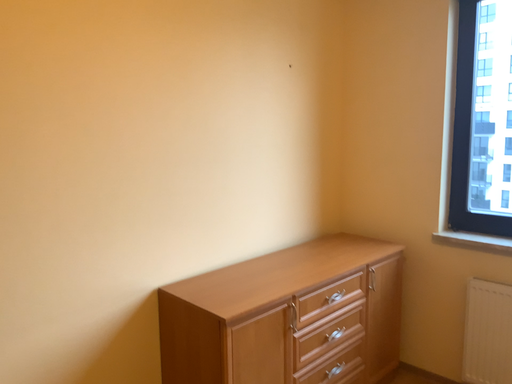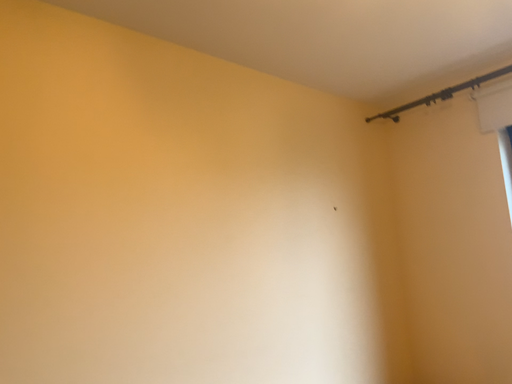
Question: Which way did the camera rotate in the video?

Choices:
 (A) rotated right
 (B) rotated left

Answer: (B)